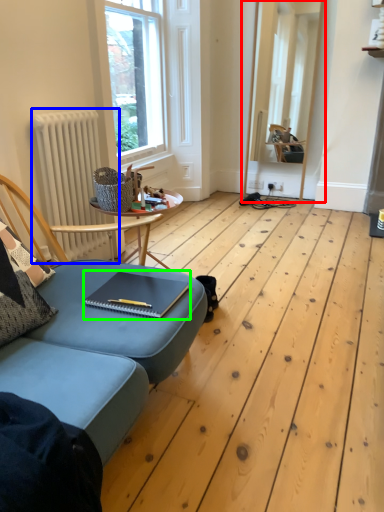
Question: Which is farther away from window frame (highlighted by a red box)? radiator (highlighted by a blue box) or notebook (highlighted by a green box)?

Choices:
 (A) radiator
 (B) notebook

Answer: (B)